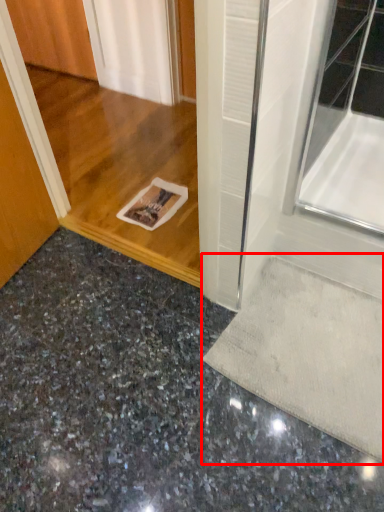
Question: Considering the relative positions of doormat (annotated by the red box) and concrete in the image provided, where is doormat (annotated by the red box) located with respect to the staircase?

Choices:
 (A) right
 (B) left

Answer: (A)